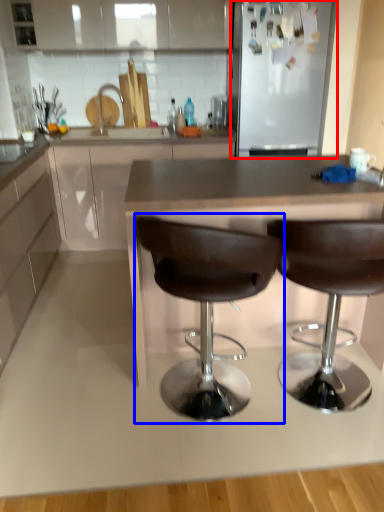
Question: Which of the following is the closest to the observer, appliance (highlighted by a red box) or chair (highlighted by a blue box)?

Choices:
 (A) appliance
 (B) chair

Answer: (B)